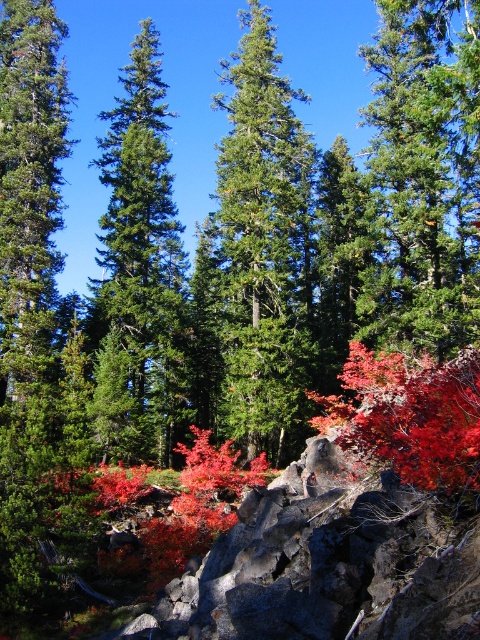
Can you confirm if green needle-like at center is taller than green matte evergreen tree at center?

Yes.

From the picture: Can you confirm if green needle-like at center is positioned below green matte evergreen tree at center?

No, green needle-like at center is not below green matte evergreen tree at center.

Find the location of a particular element. The height and width of the screenshot is (640, 480). green needle-like at center is located at coordinates (422, 177).

Who is shorter, green needle-like at center or green glossy pine tree at center?

green glossy pine tree at center is shorter.

Is point (454, 278) more distant than point (169, 346)?

That is True.

Between point (412, 104) and point (103, 289), which one is positioned behind?

Point (103, 289)

I want to click on green needle-like at center, so click(422, 177).

Does green matte evergreen tree at center appear on the right side of green glossy pine tree at center?

Indeed, green matte evergreen tree at center is positioned on the right side of green glossy pine tree at center.

Does point (303, 284) come closer to viewer compared to point (129, 320)?

No, it is behind (129, 320).

Find the location of `green matte evergreen tree at center`. green matte evergreen tree at center is located at coordinates (264, 241).